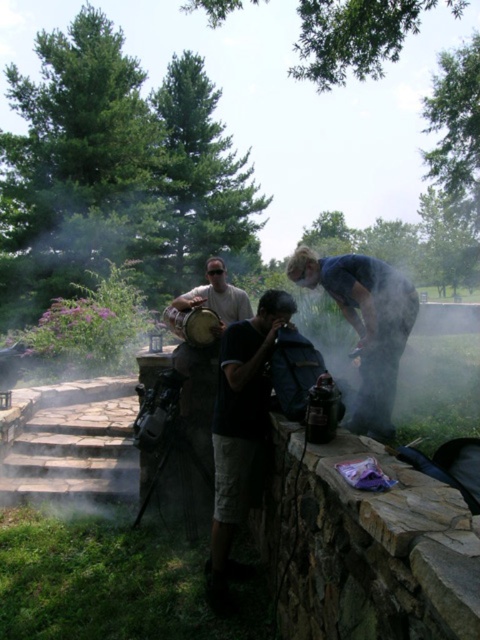
Question: Does dark blue shirt at center have a lesser width compared to blue denim shirt at center?

Choices:
 (A) no
 (B) yes

Answer: (A)

Question: Among these points, which one is nearest to the camera?

Choices:
 (A) (180, 294)
 (B) (217, 525)
 (C) (370, 296)

Answer: (B)

Question: Is dark blue shirt at center thinner than matte brown shirt at center?

Choices:
 (A) no
 (B) yes

Answer: (B)

Question: Which of the following is the farthest from the observer?

Choices:
 (A) (365, 428)
 (B) (273, 296)

Answer: (A)

Question: Which object is the farthest from the blue denim shirt at center?

Choices:
 (A) dark blue shirt at center
 (B) matte brown shirt at center

Answer: (B)

Question: Does dark blue shirt at center come in front of blue denim shirt at center?

Choices:
 (A) yes
 (B) no

Answer: (A)